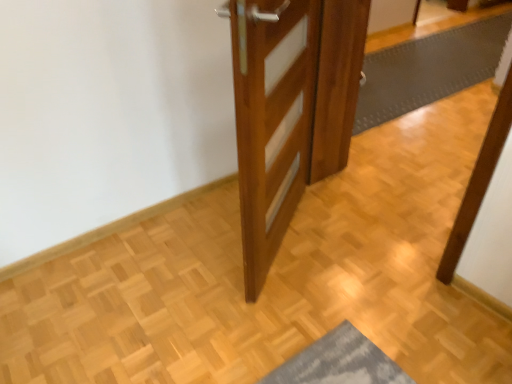
This screenshot has width=512, height=384. In order to click on free point in front of wooden door at center in this screenshot , I will do tap(290, 316).